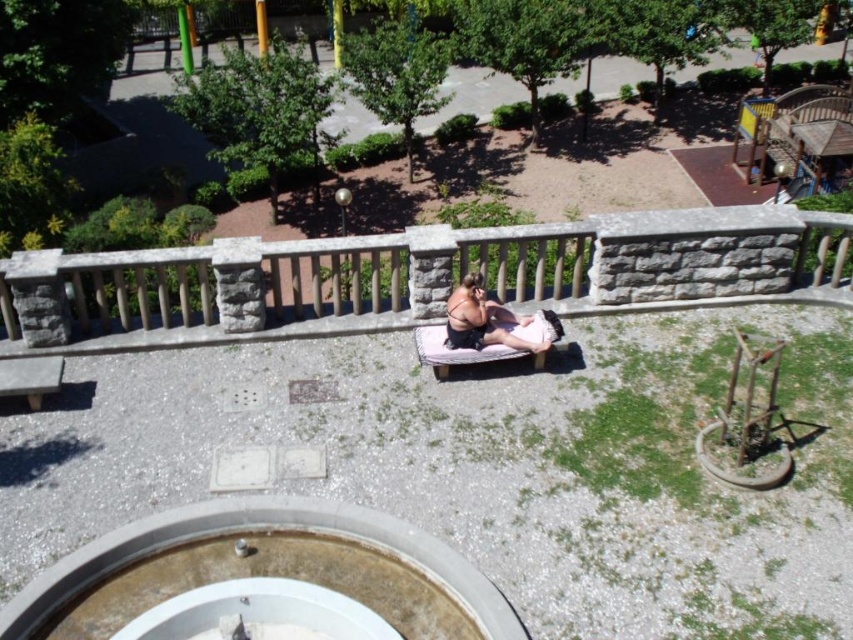
Is stone balustrade at center further to the viewer compared to dark pink fabric at center?

No, it is in front of dark pink fabric at center.

This screenshot has width=853, height=640. I want to click on stone balustrade at center, so click(421, 276).

Find the location of a particular element. stone balustrade at center is located at coordinates (421, 276).